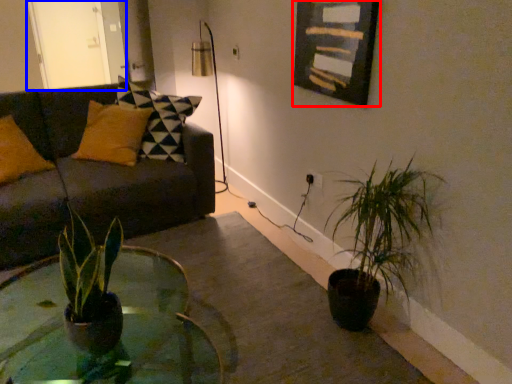
Question: Which object appears farthest to the camera in this image, picture frame (highlighted by a red box) or glass door (highlighted by a blue box)?

Choices:
 (A) picture frame
 (B) glass door

Answer: (B)